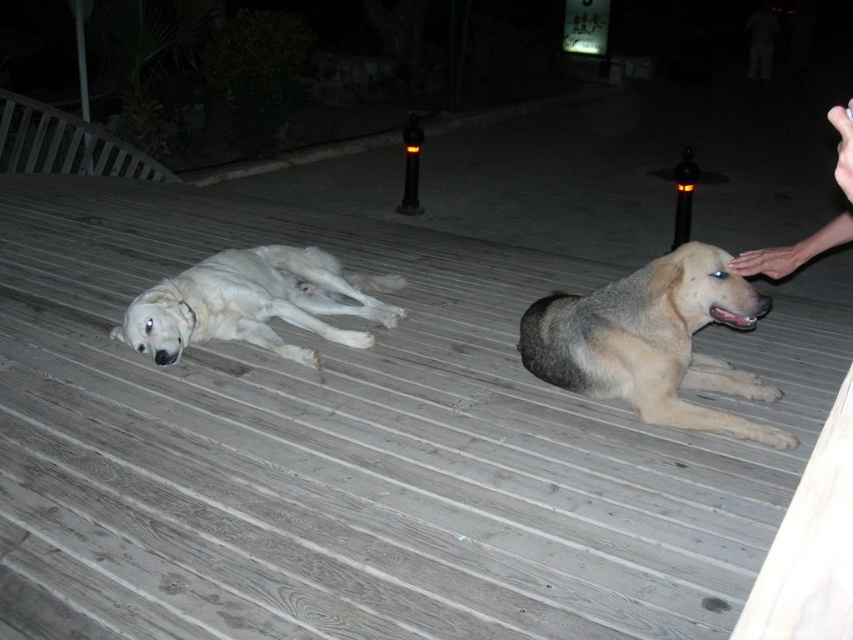
Measure the distance from gray wood deck at center to white fur dog at left.

A distance of 16.52 inches exists between gray wood deck at center and white fur dog at left.

Measure the distance between gray wood deck at center and camera.

gray wood deck at center is 5.66 feet away from camera.

I want to click on gray wood deck at center, so click(x=361, y=445).

Does point (151, 301) lie behind point (846, 230)?

Yes.

This screenshot has height=640, width=853. Identify the location of white fur dog at left. (254, 301).

Can you confirm if gray wood deck at center is wider than light brown fur dog at center?

Indeed, gray wood deck at center has a greater width compared to light brown fur dog at center.

Does gray wood deck at center lie behind light brown fur dog at center?

No.

Locate an element on the screen. The image size is (853, 640). gray wood deck at center is located at coordinates (361, 445).

Image resolution: width=853 pixels, height=640 pixels. I want to click on gray wood deck at center, so click(x=361, y=445).